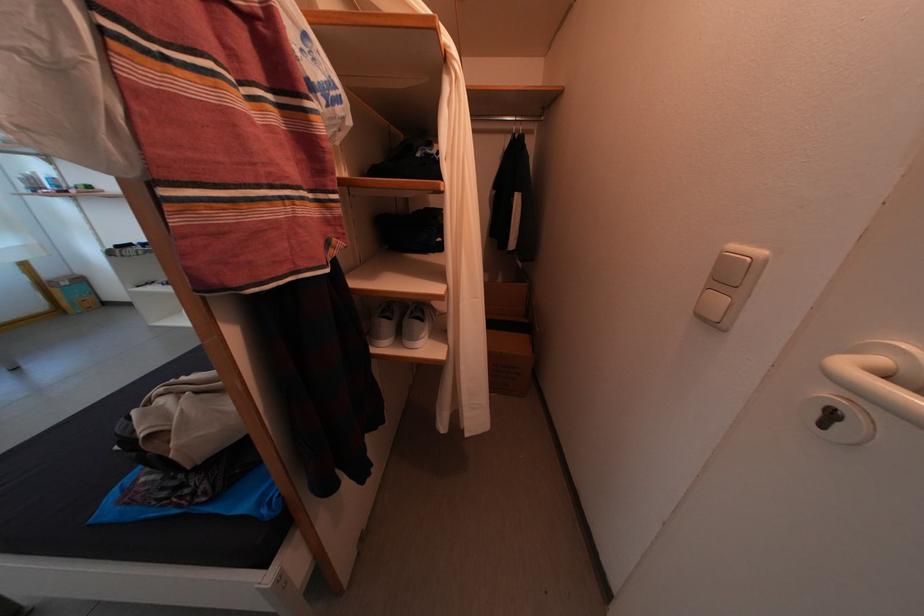
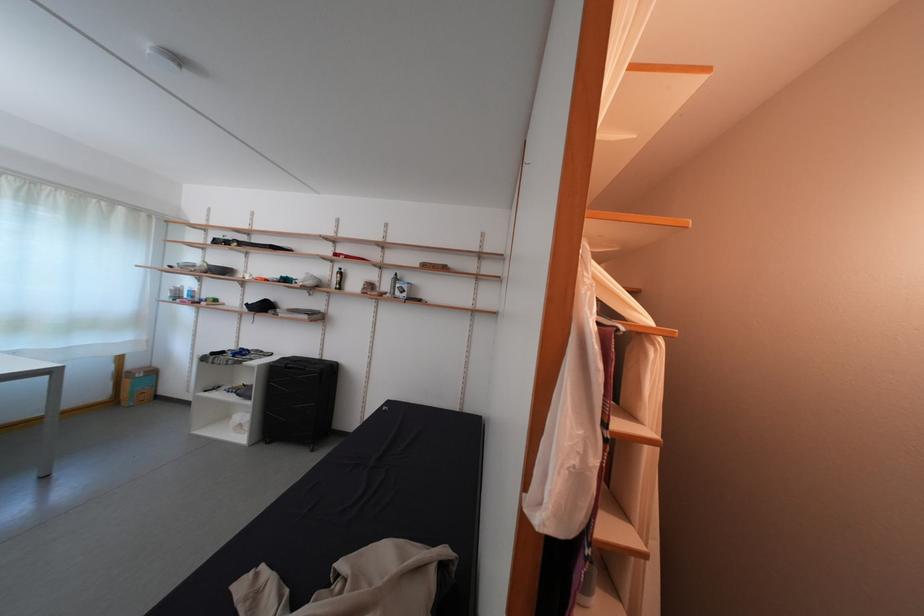
Question: The images are taken continuously from a first-person perspective. In which direction is your viewpoint rotating?

Choices:
 (A) Left
 (B) Right
 (C) Up
 (D) Down

Answer: (C)